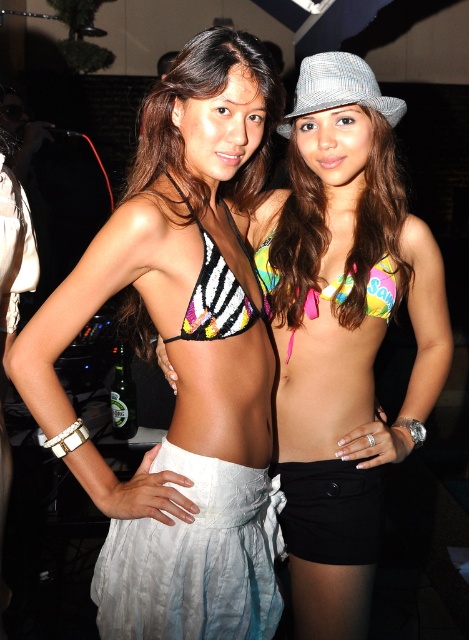
You are a photographer at a fashion show. You need to capture a closeup shot of the multicolored sequined bikini top at center and the gray herringbone fedora at upper center. Since the camera can only focus on one object at a time, which object should you choose to ensure the sequined details are clearly visible?

The multicolored sequined bikini top at center is larger in size than the gray herringbone fedora at upper center, so choosing to focus on the multicolored sequined bikini top at center will allow the sequined details to be more clearly visible due to its larger size.

You are a photographer at a party who needs to capture a closeup shot of both the multicolored bikini top at center and the multicolored sequined bikini top at center. Your camera has a maximum focus range of 8 inches. Can you fit both subjects in the same frame without moving the camera?

The multicolored bikini top at center and multicolored sequined bikini top at center are 8.46 inches apart. Since the distance between them exceeds the camera maximum focus range of 8 inches, you cannot fit both in the same frame without moving the camera.